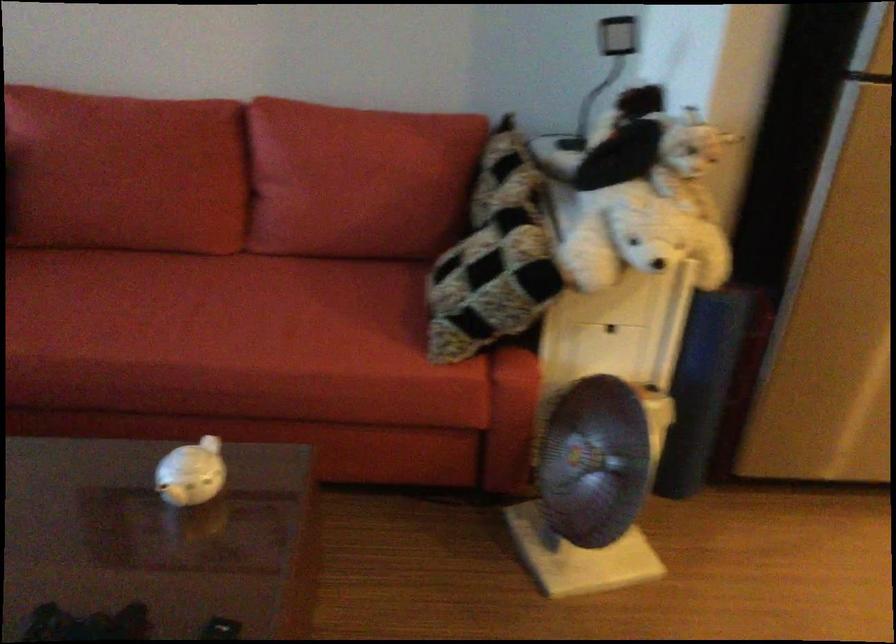
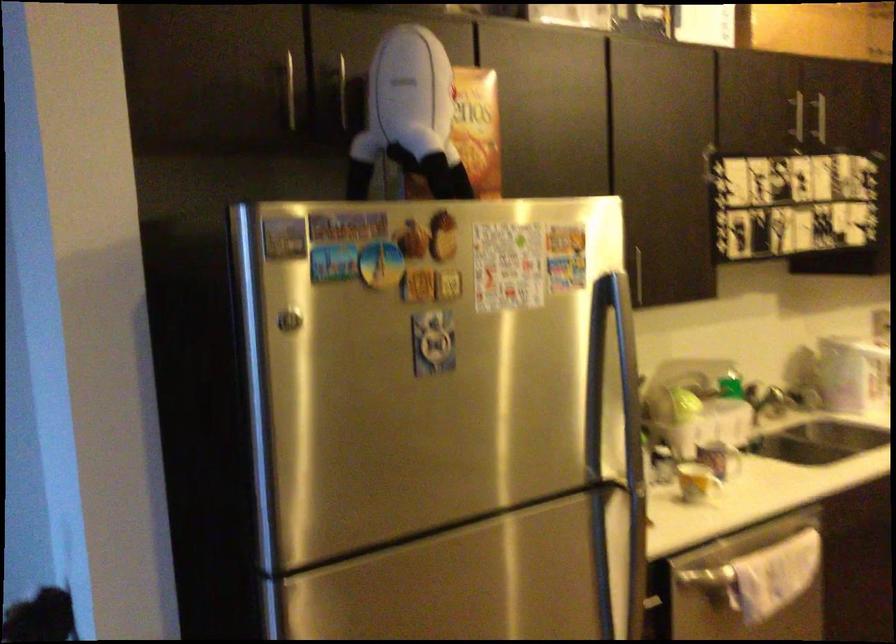
First-person continuous shooting, in which direction is the camera rotating?

The camera rotated toward right-up.